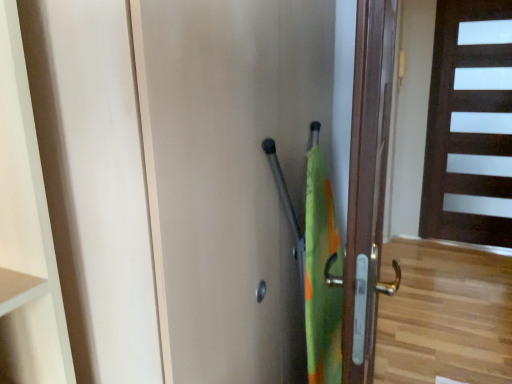
Question: From a real-world perspective, does matte wood door at center, the third door positioned from the back, sit lower than dark wood door at right, which is the third door in front-to-back order?

Choices:
 (A) yes
 (B) no

Answer: (A)

Question: Can you confirm if matte wood door at center, marked as the 3th door in a right-to-left arrangement, is smaller than dark wood door at right, which is the third door in front-to-back order?

Choices:
 (A) no
 (B) yes

Answer: (A)

Question: Considering the relative sizes of matte wood door at center, positioned as the 1th door in front-to-back order, and dark wood door at right, the 1th door viewed from the back, in the image provided, is matte wood door at center, positioned as the 1th door in front-to-back order, taller than dark wood door at right, the 1th door viewed from the back,?

Choices:
 (A) no
 (B) yes

Answer: (A)

Question: Does matte wood door at center, which is the first door in left-to-right order, have a lesser width compared to dark wood door at right, which is counted as the third door, starting from the left?

Choices:
 (A) yes
 (B) no

Answer: (B)

Question: Does matte wood door at center, the third door positioned from the back, appear on the right side of dark wood door at right, which is the third door in front-to-back order?

Choices:
 (A) no
 (B) yes

Answer: (A)

Question: Is matte wood door at center, the third door positioned from the back, positioned beyond the bounds of dark wood door at right, acting as the first door starting from the right?

Choices:
 (A) yes
 (B) no

Answer: (A)

Question: From the image's perspective, does matte wood door at center, which is the first door in left-to-right order, appear lower than brown wooden door at right, the 2th door in the front-to-back sequence?

Choices:
 (A) no
 (B) yes

Answer: (B)

Question: Is matte wood door at center, marked as the 3th door in a right-to-left arrangement, taller than brown wooden door at right, the 2th door when ordered from back to front?

Choices:
 (A) yes
 (B) no

Answer: (A)

Question: Is matte wood door at center, marked as the 3th door in a right-to-left arrangement, looking in the opposite direction of brown wooden door at right, the 2th door in the front-to-back sequence?

Choices:
 (A) no
 (B) yes

Answer: (B)

Question: Is matte wood door at center, positioned as the 1th door in front-to-back order, at the left side of brown wooden door at right, the 2th door when ordered from back to front?

Choices:
 (A) yes
 (B) no

Answer: (A)

Question: Does matte wood door at center, which is the first door in left-to-right order, have a lesser width compared to brown wooden door at right, which appears as the 2th door when viewed from the left?

Choices:
 (A) no
 (B) yes

Answer: (B)

Question: From a real-world perspective, is matte wood door at center, the third door positioned from the back, positioned over brown wooden door at right, which appears as the 2th door when viewed from the left, based on gravity?

Choices:
 (A) no
 (B) yes

Answer: (A)

Question: Is the position of brown wooden door at right, which is the second door from right to left, more distant than that of matte wood door at center, positioned as the 1th door in front-to-back order?

Choices:
 (A) no
 (B) yes

Answer: (B)